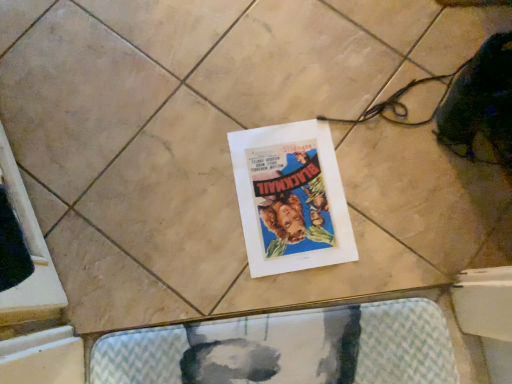
Identify the location of vacant location below matte paper comic book at center (from a real-world perspective). The width and height of the screenshot is (512, 384). [x=289, y=197].